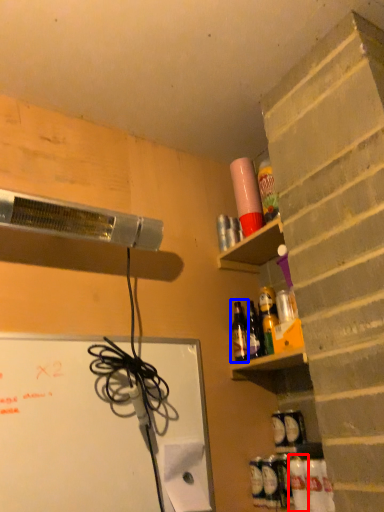
Question: Which object appears farthest to the camera in this image, bottle (highlighted by a red box) or bottle (highlighted by a blue box)?

Choices:
 (A) bottle
 (B) bottle

Answer: (B)